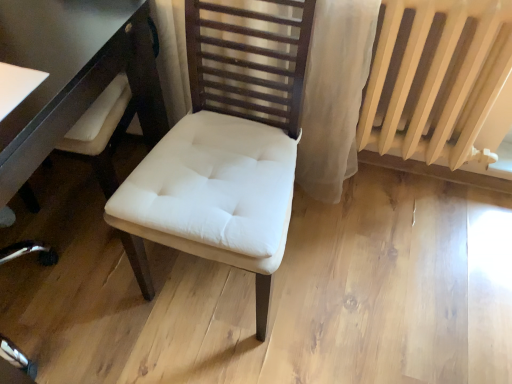
Question: Is white glossy table at left looking in the opposite direction of white fabric chair at center?

Choices:
 (A) yes
 (B) no

Answer: (B)

Question: Is white glossy table at left smaller than white fabric chair at center?

Choices:
 (A) yes
 (B) no

Answer: (B)

Question: Is white glossy table at left further to camera compared to white fabric chair at center?

Choices:
 (A) yes
 (B) no

Answer: (A)

Question: Is white glossy table at left at the right side of white fabric chair at center?

Choices:
 (A) yes
 (B) no

Answer: (B)

Question: Can you confirm if white glossy table at left is positioned to the left of white fabric chair at center?

Choices:
 (A) no
 (B) yes

Answer: (B)

Question: Is white glossy table at left outside white fabric chair at center?

Choices:
 (A) yes
 (B) no

Answer: (A)

Question: From the image's perspective, does beige painted radiator at right appear higher than white glossy table at left?

Choices:
 (A) no
 (B) yes

Answer: (A)

Question: Is white glossy table at left a part of beige painted radiator at right?

Choices:
 (A) no
 (B) yes

Answer: (A)

Question: Does beige painted radiator at right have a lesser height compared to white glossy table at left?

Choices:
 (A) yes
 (B) no

Answer: (A)

Question: Could you tell me if beige painted radiator at right is facing white glossy table at left?

Choices:
 (A) no
 (B) yes

Answer: (A)

Question: Is the depth of beige painted radiator at right less than that of white glossy table at left?

Choices:
 (A) yes
 (B) no

Answer: (B)

Question: Is beige painted radiator at right positioned far away from white glossy table at left?

Choices:
 (A) no
 (B) yes

Answer: (A)

Question: Is beige painted radiator at right smaller than white fabric chair at center?

Choices:
 (A) no
 (B) yes

Answer: (B)